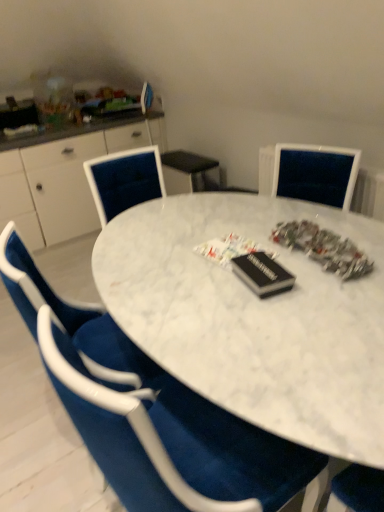
Question: Is white glossy cabinet at left outside of white marble table at center?

Choices:
 (A) no
 (B) yes

Answer: (B)

Question: From a real-world perspective, is white glossy cabinet at left positioned over white marble table at center based on gravity?

Choices:
 (A) yes
 (B) no

Answer: (A)

Question: Considering the relative positions of white glossy cabinet at left and white marble table at center in the image provided, is white glossy cabinet at left to the left of white marble table at center from the viewer's perspective?

Choices:
 (A) yes
 (B) no

Answer: (A)

Question: Is white glossy cabinet at left to the right of white marble table at center from the viewer's perspective?

Choices:
 (A) yes
 (B) no

Answer: (B)

Question: Is white glossy cabinet at left surrounding white marble table at center?

Choices:
 (A) yes
 (B) no

Answer: (B)

Question: Could you tell me if white glossy cabinet at left is turned towards white marble table at center?

Choices:
 (A) yes
 (B) no

Answer: (A)

Question: From the image's perspective, is white glossy cabinet at left above velvet blue chair at center?

Choices:
 (A) yes
 (B) no

Answer: (A)

Question: From the image's perspective, would you say white glossy cabinet at left is shown under velvet blue chair at center?

Choices:
 (A) no
 (B) yes

Answer: (A)

Question: Is white glossy cabinet at left looking in the opposite direction of velvet blue chair at center?

Choices:
 (A) no
 (B) yes

Answer: (A)

Question: Considering the relative sizes of white glossy cabinet at left and velvet blue chair at center in the image provided, is white glossy cabinet at left smaller than velvet blue chair at center?

Choices:
 (A) yes
 (B) no

Answer: (B)

Question: Considering the relative positions of white glossy cabinet at left and velvet blue chair at center in the image provided, is white glossy cabinet at left to the right of velvet blue chair at center from the viewer's perspective?

Choices:
 (A) yes
 (B) no

Answer: (B)

Question: Is white glossy cabinet at left next to velvet blue chair at center?

Choices:
 (A) no
 (B) yes

Answer: (A)

Question: Would you say velvet blue chair at center contains white marble table at center?

Choices:
 (A) yes
 (B) no

Answer: (B)